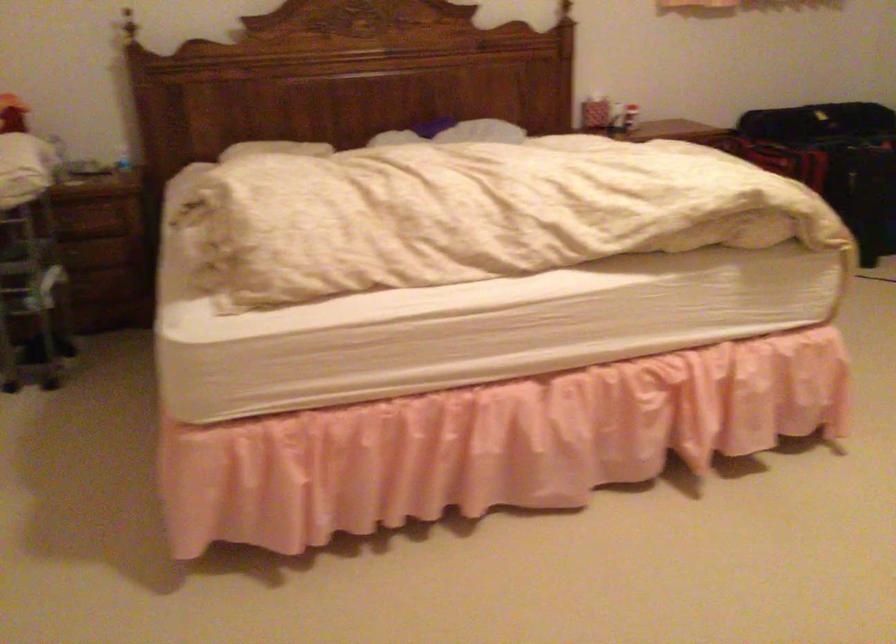
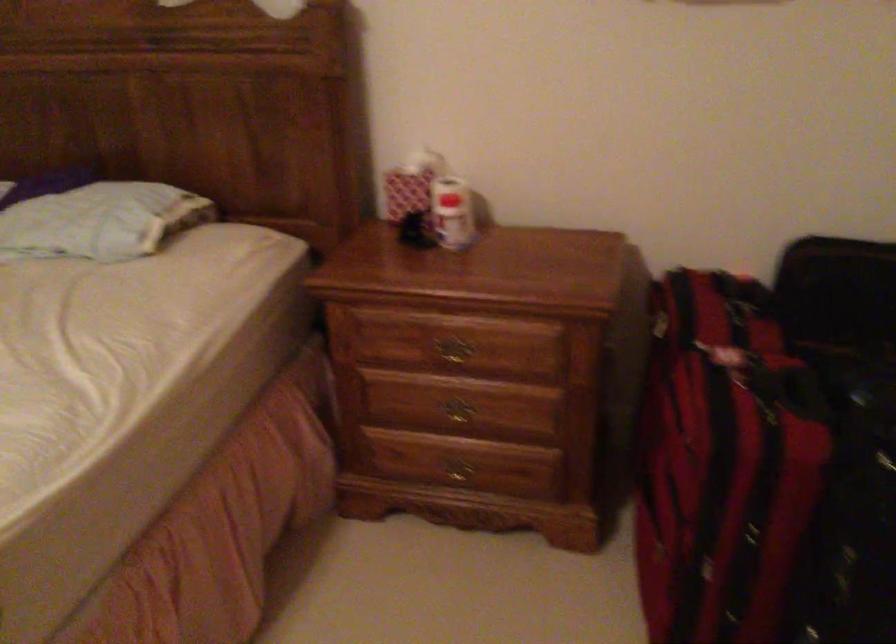
The point at (636, 90) is marked in the first image. Where is the corresponding point in the second image?

(452, 213)